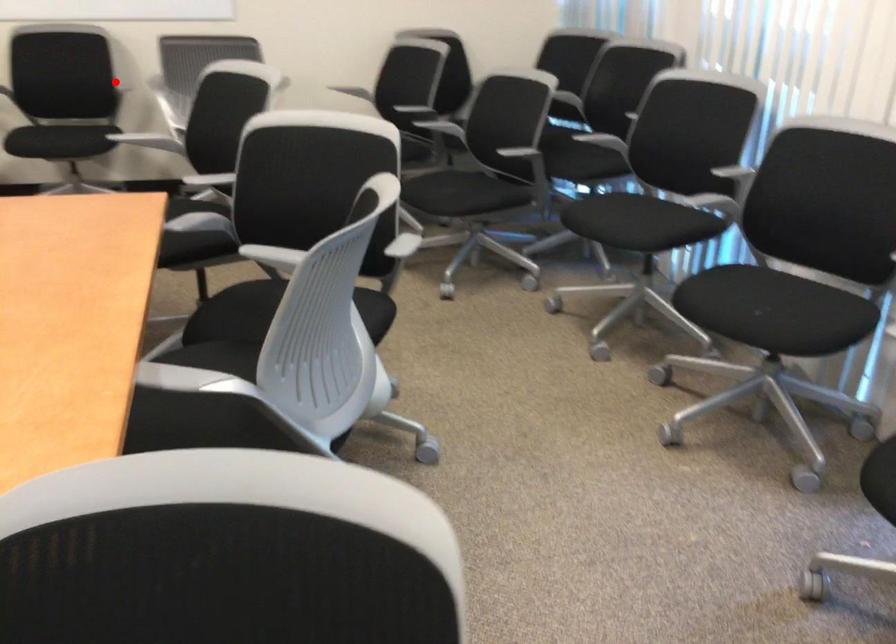
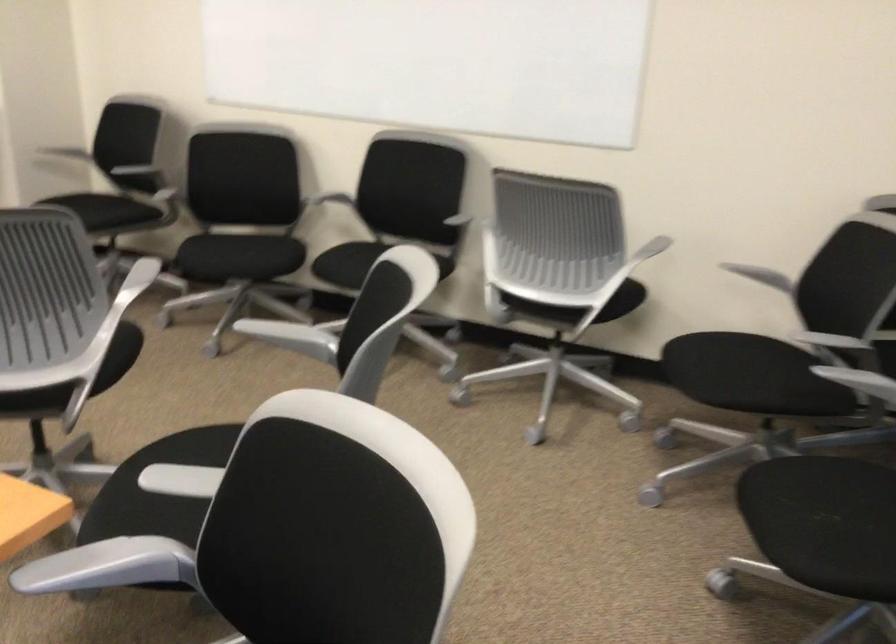
Question: I am providing you with two images of the same scene from different viewpoints. Image1 has a red point marked. In image2, the corresponding 3D location appears at what relative position? Reply with the corresponding letter.

Choices:
 (A) Closer
 (B) Farther

Answer: (A)